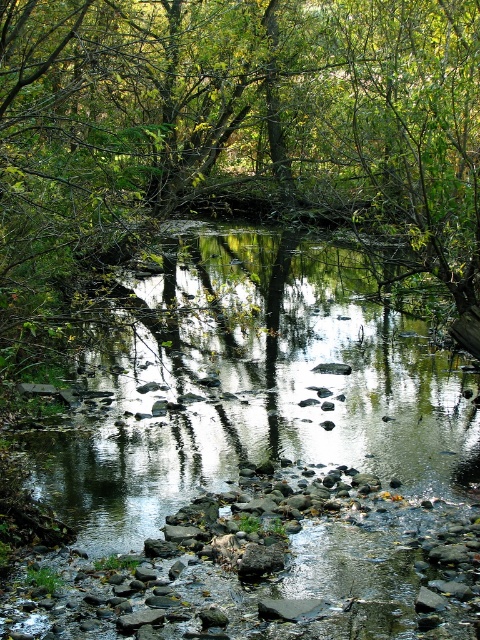
You are planning to take a photo of the green leafy tree at center and the gray smooth rock at center. Which object will appear larger in your photo?

The green leafy tree at center will appear larger in the photo because it is bigger than the gray smooth rock at center.

You are standing at the edge of the stream and want to cross to the other side. You see a green leafy tree at center and a gray smooth rock at center. Which object should you step on first to cross the stream?

You should step on the gray smooth rock at center first because the green leafy tree at center is to the right of it, meaning the rock is closer to your starting position on the left side of the stream.